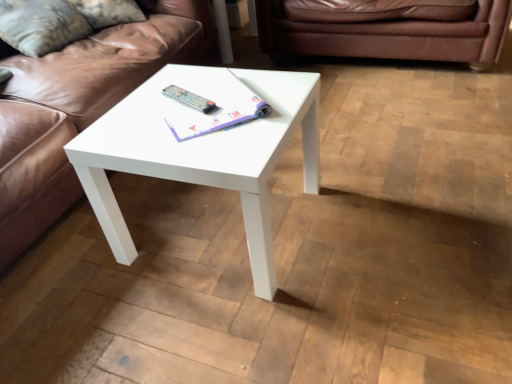
The height and width of the screenshot is (384, 512). Describe the element at coordinates (211, 102) in the screenshot. I see `white paper book at center` at that location.

This screenshot has height=384, width=512. I want to click on silver metallic remote at center, so click(x=189, y=99).

What is the approximate height of brown leather couch at center, which appears as the 1th studio couch when viewed from the right?

brown leather couch at center, which appears as the 1th studio couch when viewed from the right, is 16.44 inches tall.

In order to click on white glossy coffee table at center in this screenshot , I will do click(x=201, y=156).

Does silver metallic remote at center have a greater width compared to brown leather couch at center, which ranks as the 2th studio couch in left-to-right order?

No.

In terms of height, does silver metallic remote at center look taller or shorter compared to brown leather couch at center, which ranks as the 2th studio couch in left-to-right order?

silver metallic remote at center is shorter than brown leather couch at center, which ranks as the 2th studio couch in left-to-right order.

Considering their positions, is silver metallic remote at center located in front of or behind brown leather couch at center, which ranks as the 2th studio couch in left-to-right order?

Clearly, silver metallic remote at center is in front of brown leather couch at center, which ranks as the 2th studio couch in left-to-right order.

How far apart are silver metallic remote at center and brown leather couch at center, which ranks as the 2th studio couch in left-to-right order?

1.34 meters.

I want to click on remote above the white glossy coffee table at center (from the image's perspective), so click(x=189, y=99).

Between white glossy coffee table at center and silver metallic remote at center, which one appears on the right side from the viewer's perspective?

Positioned to the right is white glossy coffee table at center.

Between point (317, 191) and point (201, 103), which one is positioned behind?

The point (317, 191) is more distant.

From the image's perspective, is white glossy coffee table at center beneath silver metallic remote at center?

Yes, from the image's perspective, white glossy coffee table at center is beneath silver metallic remote at center.

From a real-world perspective, is velvet floral pillow at upper left on brown leather couch at center, which ranks as the 2th studio couch in left-to-right order?

Yes.

From the image's perspective, which is below, velvet floral pillow at upper left or brown leather couch at center, which ranks as the 2th studio couch in left-to-right order?

velvet floral pillow at upper left, from the image's perspective.

Is velvet floral pillow at upper left turned away from brown leather couch at center, which ranks as the 2th studio couch in left-to-right order?

velvet floral pillow at upper left is not turned away from brown leather couch at center, which ranks as the 2th studio couch in left-to-right order.

In the scene shown: Are velvet floral pillow at upper left and brown leather couch at center, which appears as the 1th studio couch when viewed from the right, far apart?

That's right, there is a large distance between velvet floral pillow at upper left and brown leather couch at center, which appears as the 1th studio couch when viewed from the right.

Which object is closer to the camera, white glossy coffee table at center or brown leather couch at upper left, arranged as the 1th studio couch when viewed from the left?

Positioned in front is brown leather couch at upper left, arranged as the 1th studio couch when viewed from the left.

Would you say white glossy coffee table at center is inside or outside brown leather couch at upper left, arranged as the 1th studio couch when viewed from the left?

white glossy coffee table at center is located beyond the bounds of brown leather couch at upper left, arranged as the 1th studio couch when viewed from the left.

Who is bigger, white glossy coffee table at center or brown leather couch at upper left, which ranks as the 2th studio couch in right-to-left order?

brown leather couch at upper left, which ranks as the 2th studio couch in right-to-left order, is bigger.

Is silver metallic remote at center positioned far away from white paper book at center?

No.

Between silver metallic remote at center and white paper book at center, which one is positioned in front?

white paper book at center is more forward.

Could you tell me if silver metallic remote at center is facing white paper book at center?

Yes.

Identify the location of remote beneath the white paper book at center (from a real-world perspective). (189, 99).

Is brown leather couch at center, which appears as the 1th studio couch when viewed from the right, next to brown leather couch at upper left, arranged as the 1th studio couch when viewed from the left?

No, brown leather couch at center, which appears as the 1th studio couch when viewed from the right, is not with brown leather couch at upper left, arranged as the 1th studio couch when viewed from the left.

Is brown leather couch at center, which appears as the 1th studio couch when viewed from the right, inside or outside of brown leather couch at upper left, which ranks as the 2th studio couch in right-to-left order?

brown leather couch at center, which appears as the 1th studio couch when viewed from the right, lies outside brown leather couch at upper left, which ranks as the 2th studio couch in right-to-left order.

Between brown leather couch at center, which ranks as the 2th studio couch in left-to-right order, and brown leather couch at upper left, which ranks as the 2th studio couch in right-to-left order, which one has larger size?

With larger size is brown leather couch at upper left, which ranks as the 2th studio couch in right-to-left order.

How different are the orientations of brown leather couch at center, which ranks as the 2th studio couch in left-to-right order, and brown leather couch at upper left, which ranks as the 2th studio couch in right-to-left order, in degrees?

90.3 degrees separate the facing orientations of brown leather couch at center, which ranks as the 2th studio couch in left-to-right order, and brown leather couch at upper left, which ranks as the 2th studio couch in right-to-left order.

In the scene shown: Does silver metallic remote at center have a greater height compared to velvet floral pillow at upper left?

No, silver metallic remote at center is not taller than velvet floral pillow at upper left.

From a real-world perspective, is silver metallic remote at center positioned over velvet floral pillow at upper left based on gravity?

No, from a real-world perspective, silver metallic remote at center is not over velvet floral pillow at upper left

Is silver metallic remote at center not near velvet floral pillow at upper left?

No, silver metallic remote at center is in close proximity to velvet floral pillow at upper left.

Which is more to the left, silver metallic remote at center or velvet floral pillow at upper left?

velvet floral pillow at upper left.

Identify the location of studio couch that is the 2nd one below the silver metallic remote at center (from a real-world perspective). This screenshot has width=512, height=384. (387, 36).

This screenshot has width=512, height=384. What are the coordinates of `coffee table that is below the silver metallic remote at center (from the image's perspective)` in the screenshot? It's located at (201, 156).

From the image, which object appears to be nearer to brown leather couch at upper left, which ranks as the 2th studio couch in right-to-left order, brown leather couch at center, which ranks as the 2th studio couch in left-to-right order, or white paper book at center?

Among the two, white paper book at center is located nearer to brown leather couch at upper left, which ranks as the 2th studio couch in right-to-left order.

Based on the photo, which object lies further to the anchor point velvet floral pillow at upper left, brown leather couch at center, which appears as the 1th studio couch when viewed from the right, or white paper book at center?

Among the two, brown leather couch at center, which appears as the 1th studio couch when viewed from the right, is located further to velvet floral pillow at upper left.

From the image, which object appears to be farther from brown leather couch at upper left, which ranks as the 2th studio couch in right-to-left order, silver metallic remote at center or brown leather couch at center, which appears as the 1th studio couch when viewed from the right?

brown leather couch at center, which appears as the 1th studio couch when viewed from the right, is further to brown leather couch at upper left, which ranks as the 2th studio couch in right-to-left order.

Estimate the real-world distances between objects in this image. Which object is closer to white paper book at center, brown leather couch at upper left, arranged as the 1th studio couch when viewed from the left, or silver metallic remote at center?

silver metallic remote at center.

Considering their positions, is white paper book at center positioned further to velvet floral pillow at upper left than white glossy coffee table at center?

Based on the image, white glossy coffee table at center appears to be further to velvet floral pillow at upper left.

Which object lies further to the anchor point white paper book at center, silver metallic remote at center or white glossy coffee table at center?

white glossy coffee table at center lies further to white paper book at center than the other object.

Looking at the image, which one is located closer to brown leather couch at center, which appears as the 1th studio couch when viewed from the right, white glossy coffee table at center or velvet floral pillow at upper left?

velvet floral pillow at upper left lies closer to brown leather couch at center, which appears as the 1th studio couch when viewed from the right, than the other object.

Looking at the image, which one is located closer to white paper book at center, white glossy coffee table at center or velvet floral pillow at upper left?

The object closer to white paper book at center is white glossy coffee table at center.

Identify the location of remote between brown leather couch at upper left, which ranks as the 2th studio couch in right-to-left order, and white paper book at center from left to right. (189, 99).

The image size is (512, 384). Find the location of `studio couch situated between velvet floral pillow at upper left and brown leather couch at center, which ranks as the 2th studio couch in left-to-right order, from left to right`. studio couch situated between velvet floral pillow at upper left and brown leather couch at center, which ranks as the 2th studio couch in left-to-right order, from left to right is located at coordinates (79, 108).

Where is `studio couch situated between velvet floral pillow at upper left and white glossy coffee table at center from left to right`? Image resolution: width=512 pixels, height=384 pixels. studio couch situated between velvet floral pillow at upper left and white glossy coffee table at center from left to right is located at coordinates (79, 108).

You are a GUI agent. You are given a task and a screenshot of the screen. Output one action in this format:
    pyautogui.click(x=<x>, y=<y>)
    Task: Click on the studio couch situated between velvet floral pillow at upper left and silver metallic remote at center from left to right
    The image size is (512, 384).
    Given the screenshot: What is the action you would take?
    pyautogui.click(x=79, y=108)